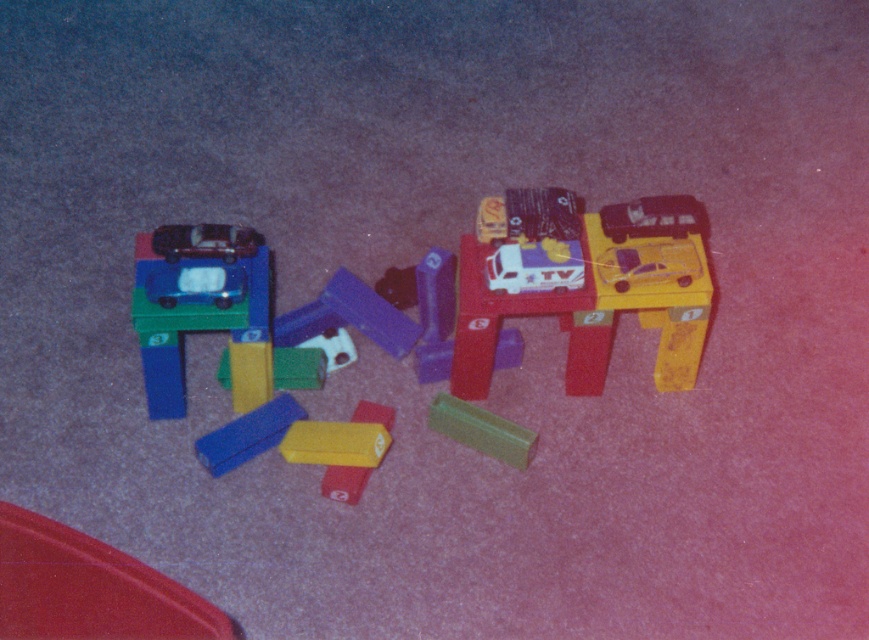
Question: Does matte plastic car at left lie behind blue matte block at lower center?

Choices:
 (A) yes
 (B) no

Answer: (B)

Question: Estimate the real-world distances between objects in this image. Which object is farther from the matte plastic car at left?

Choices:
 (A) matte black car at left
 (B) matte plastic toy car at upper left

Answer: (B)

Question: From the image, what is the correct spatial relationship of matte plastic car at left in relation to blue matte block at lower center?

Choices:
 (A) right
 (B) left

Answer: (B)

Question: Which point appears farthest from the camera in this image?

Choices:
 (A) (481, 413)
 (B) (186, 234)
 (C) (277, 412)

Answer: (A)

Question: Which of these objects is positioned closest to the green matte block at center?

Choices:
 (A) matte black car at left
 (B) blue matte block at lower center

Answer: (B)

Question: Is matte plastic toy car at upper left positioned behind blue matte block at lower center?

Choices:
 (A) no
 (B) yes

Answer: (A)